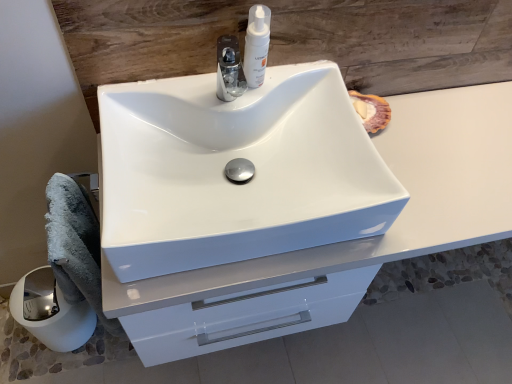
Locate an element on the screen. free spot above white glossy cabinet at center (from a real-world perspective) is located at coordinates (418, 158).